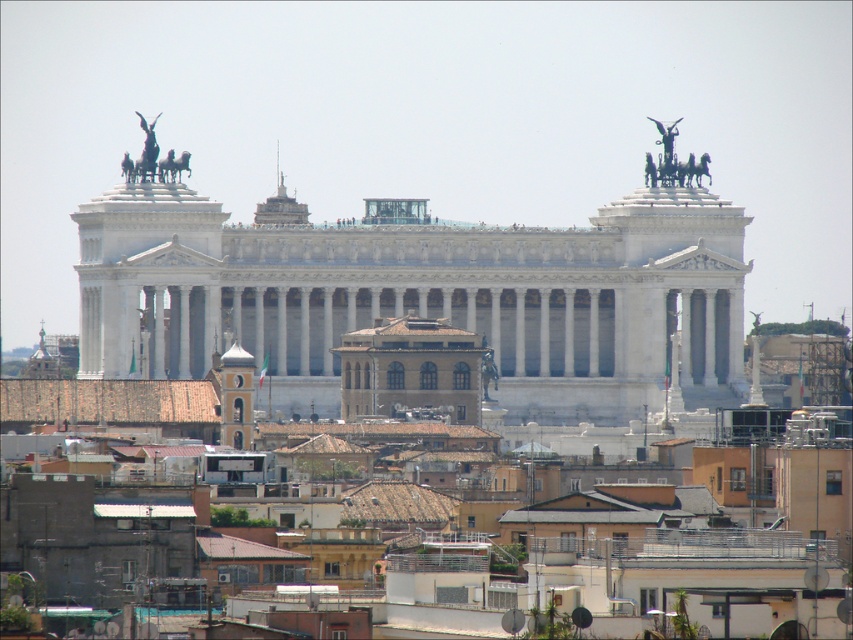
Is smooth gray tower at center taller than polished bronze chariot at upper left?

Yes, smooth gray tower at center is taller than polished bronze chariot at upper left.

Who is taller, smooth gray tower at center or polished bronze chariot at upper left?

Standing taller between the two is smooth gray tower at center.

The height and width of the screenshot is (640, 853). What do you see at coordinates (236, 397) in the screenshot?
I see `smooth gray tower at center` at bounding box center [236, 397].

Where is `smooth gray tower at center`? The width and height of the screenshot is (853, 640). smooth gray tower at center is located at coordinates (236, 397).

Between smooth gray tower at center and polished bronze chariot at upper right, which one appears on the right side from the viewer's perspective?

From the viewer's perspective, polished bronze chariot at upper right appears more on the right side.

Where is `smooth gray tower at center`? smooth gray tower at center is located at coordinates (236, 397).

Does polished bronze chariot at upper right lie behind polished bronze chariot at upper left?

Yes, it is behind polished bronze chariot at upper left.

Which of these two, polished bronze chariot at upper right or polished bronze chariot at upper left, stands taller?

polished bronze chariot at upper right is taller.

Locate an element on the screen. This screenshot has height=640, width=853. polished bronze chariot at upper right is located at coordinates (672, 161).